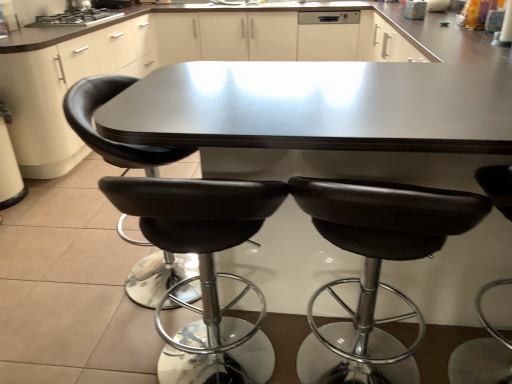
Question: Is white matte dishwasher at upper center to the left of black leather chair at center, acting as the third chair starting from the right, from the viewer's perspective?

Choices:
 (A) no
 (B) yes

Answer: (A)

Question: Considering the relative sizes of white matte dishwasher at upper center and black leather chair at center, acting as the third chair starting from the right, in the image provided, is white matte dishwasher at upper center thinner than black leather chair at center, acting as the third chair starting from the right,?

Choices:
 (A) yes
 (B) no

Answer: (A)

Question: Does white matte dishwasher at upper center appear on the right side of black leather chair at center, which ranks as the 2th chair in left-to-right order?

Choices:
 (A) yes
 (B) no

Answer: (A)

Question: Is black leather chair at center, which ranks as the 2th chair in left-to-right order, at the back of white matte dishwasher at upper center?

Choices:
 (A) yes
 (B) no

Answer: (B)

Question: Is white matte dishwasher at upper center wider than black leather chair at center, which ranks as the 2th chair in left-to-right order?

Choices:
 (A) yes
 (B) no

Answer: (B)

Question: From a real-world perspective, is shiny dark wood table at center physically located above or below white matte dishwasher at upper center?

Choices:
 (A) above
 (B) below

Answer: (B)

Question: In terms of width, does shiny dark wood table at center look wider or thinner when compared to white matte dishwasher at upper center?

Choices:
 (A) wide
 (B) thin

Answer: (A)

Question: Is shiny dark wood table at center in front of or behind white matte dishwasher at upper center in the image?

Choices:
 (A) front
 (B) behind

Answer: (A)

Question: Considering the positions of point (329, 115) and point (302, 39), is point (329, 115) closer or farther from the camera than point (302, 39)?

Choices:
 (A) closer
 (B) farther

Answer: (A)

Question: Is black leather stool at center, acting as the fourth chair starting from the right, situated inside shiny dark wood table at center or outside?

Choices:
 (A) inside
 (B) outside

Answer: (A)

Question: From a real-world perspective, relative to shiny dark wood table at center, is black leather stool at center, acting as the fourth chair starting from the right, vertically above or below?

Choices:
 (A) below
 (B) above

Answer: (B)

Question: Visually, is black leather stool at center, acting as the fourth chair starting from the right, positioned to the left or to the right of shiny dark wood table at center?

Choices:
 (A) right
 (B) left

Answer: (B)

Question: In the image, is black leather stool at center, which is counted as the first chair, starting from the left, positioned in front of or behind shiny dark wood table at center?

Choices:
 (A) behind
 (B) front

Answer: (A)

Question: Based on their sizes in the image, would you say black leather chair at center, which ranks as the 2th chair in left-to-right order, is bigger or smaller than black leather stool at right, positioned as the first chair in right-to-left order?

Choices:
 (A) small
 (B) big

Answer: (B)

Question: Is black leather chair at center, acting as the third chair starting from the right, inside or outside of black leather stool at right, positioned as the first chair in right-to-left order?

Choices:
 (A) outside
 (B) inside

Answer: (A)